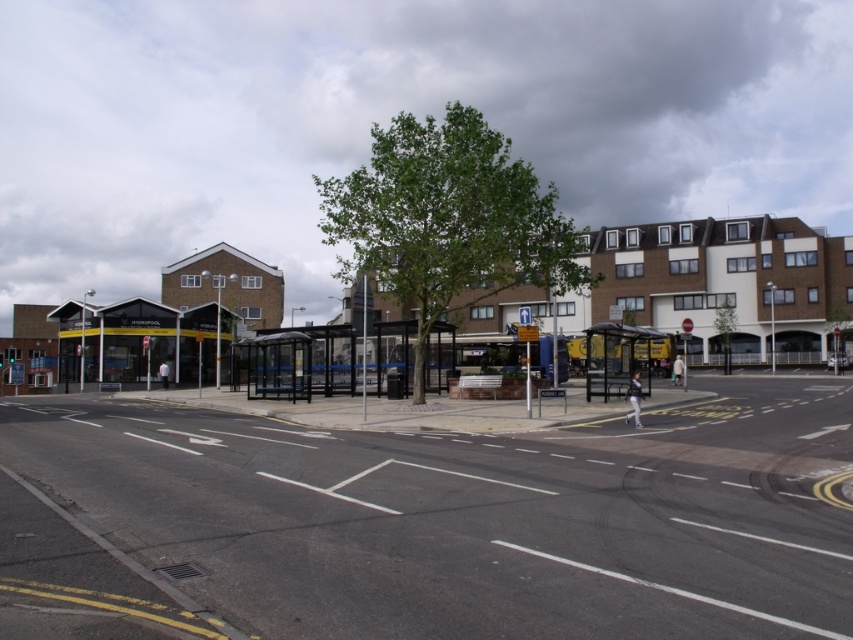
You are a drone operator trying to capture aerial footage of the urban street scene. You have two points marked on your screen at coordinates point (x=315, y=445) and point (x=625, y=384). Which point should you prioritize if you want to film the closest part of the scene to the camera?

Point (x=315, y=445) is closer to the camera than point (x=625, y=384), so you should prioritize filming the point (x=315, y=445) to capture the closest part of the scene.

You are a delivery drone navigating an urban area. Your GPS shows a delivery point at coordinates point (474, 518). According to the image, what type of surface will you land on?

The point (474, 518) indicates black asphalt road at center, so the delivery drone will land on a black asphalt road.